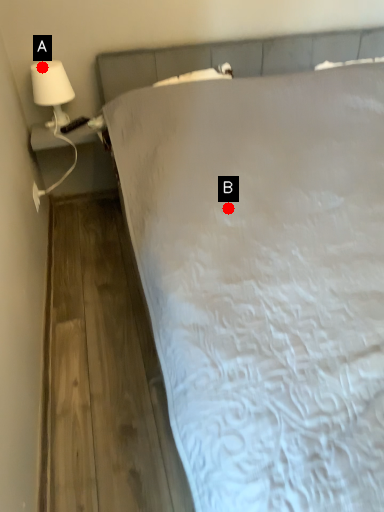
Question: Two points are circled on the image, labeled by A and B beside each circle. Among these points, which one is farthest from the camera?

Choices:
 (A) A is further
 (B) B is further

Answer: (A)